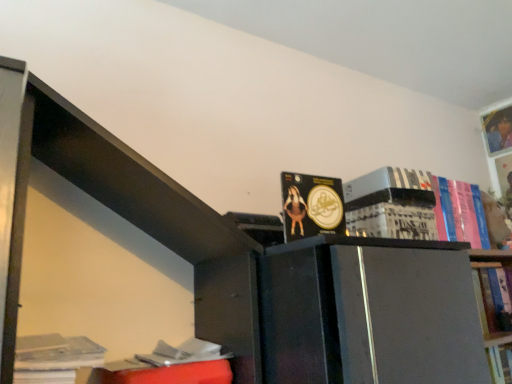
Question: Considering the relative sizes of black matte book at upper right, the first paperback book in the top-to-bottom sequence, and matte gold coin at center, the 4th book when ordered from right to left, in the image provided, is black matte book at upper right, the first paperback book in the top-to-bottom sequence, smaller than matte gold coin at center, the 4th book when ordered from right to left,?

Choices:
 (A) no
 (B) yes

Answer: (A)

Question: From the image's perspective, is black matte book at upper right, the first paperback book in the top-to-bottom sequence, located above matte gold coin at center, the fourth book positioned from the back?

Choices:
 (A) no
 (B) yes

Answer: (B)

Question: Is black matte book at upper right, the 2th paperback book when ordered from bottom to top, oriented towards matte gold coin at center, the 2th book positioned from the front?

Choices:
 (A) yes
 (B) no

Answer: (B)

Question: Is black matte book at upper right, the 2th paperback book when ordered from bottom to top, touching matte gold coin at center, the 2th book from the left?

Choices:
 (A) no
 (B) yes

Answer: (A)

Question: Is black matte book at upper right, the 2th paperback book when ordered from bottom to top, completely or partially outside of matte gold coin at center, the 2th book positioned from the front?

Choices:
 (A) no
 (B) yes

Answer: (B)

Question: Is white paper at center, the second paperback book positioned from the top, wider or thinner than hardcover book at upper right, the first book viewed from the right?

Choices:
 (A) thin
 (B) wide

Answer: (B)

Question: Is white paper at center, the first paperback book ordered from the bottom, to the left or to the right of hardcover book at upper right, marked as the fifth book in a front-to-back arrangement, in the image?

Choices:
 (A) left
 (B) right

Answer: (A)

Question: Considering the positions of white paper at center, the first paperback book ordered from the bottom, and hardcover book at upper right, the first book viewed from the right, in the image, is white paper at center, the first paperback book ordered from the bottom, taller or shorter than hardcover book at upper right, the first book viewed from the right,?

Choices:
 (A) short
 (B) tall

Answer: (A)

Question: From a real-world perspective, is white paper at center, the second paperback book positioned from the top, above or below hardcover book at upper right, the 1th book viewed from the back?

Choices:
 (A) below
 (B) above

Answer: (A)

Question: From a real-world perspective, is hardcover book at upper right, arranged as the 4th book when viewed from the left, above or below white paper stack at lower left, which appears as the first book when viewed from the left?

Choices:
 (A) below
 (B) above

Answer: (B)

Question: Looking at their shapes, would you say hardcover book at upper right, arranged as the 4th book when viewed from the left, is wider or thinner than white paper stack at lower left, which ranks as the fifth book in back-to-front order?

Choices:
 (A) thin
 (B) wide

Answer: (A)

Question: In the image, is hardcover book at upper right, marked as the second book in a right-to-left arrangement, positioned in front of or behind white paper stack at lower left, which ranks as the fifth book in back-to-front order?

Choices:
 (A) front
 (B) behind

Answer: (B)

Question: Based on their positions, is hardcover book at upper right, arranged as the 4th book when viewed from the left, located to the left or right of white paper stack at lower left, which appears as the first book when viewed from the left?

Choices:
 (A) right
 (B) left

Answer: (A)

Question: From their relative heights in the image, would you say hardcover book at upper right, arranged as the 3th book when viewed from the front, is taller or shorter than white paper at center, the second paperback book positioned from the top?

Choices:
 (A) tall
 (B) short

Answer: (A)

Question: From the image's perspective, is hardcover book at upper right, marked as the third book in a back-to-front arrangement, above or below white paper at center, the first paperback book ordered from the bottom?

Choices:
 (A) below
 (B) above

Answer: (B)